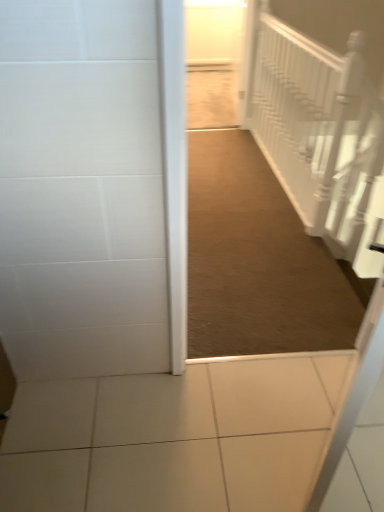
This screenshot has height=512, width=384. I want to click on free space above brown carpet at center (from a real-world perspective), so click(240, 219).